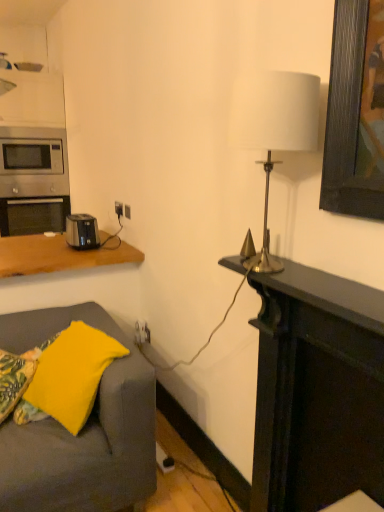
Describe the element at coordinates (317, 390) in the screenshot. I see `dark wood fireplace at right` at that location.

Describe the element at coordinates (72, 374) in the screenshot. I see `yellow fabric pillow at lower left, the 1th pillow when ordered from right to left` at that location.

Describe the element at coordinates (274, 129) in the screenshot. This screenshot has width=384, height=512. I see `white fabric lampshade at upper right` at that location.

In order to click on satin silver microwave at left in this screenshot , I will do `click(33, 162)`.

Locate an element on the screen. This screenshot has height=512, width=384. dark wood fireplace at right is located at coordinates (317, 390).

Does satin silver microwave at left lie behind white fabric lampshade at upper right?

That is True.

Is satin silver microwave at left inside or outside of white fabric lampshade at upper right?

satin silver microwave at left is located beyond the bounds of white fabric lampshade at upper right.

From the image's perspective, relative to white fabric lampshade at upper right, is satin silver microwave at left above or below?

satin silver microwave at left is situated higher than white fabric lampshade at upper right in the image.

How different are the orientations of satin silver microwave at left and white fabric lampshade at upper right in degrees?

90 degrees separate the facing orientations of satin silver microwave at left and white fabric lampshade at upper right.

From the image's perspective, who appears lower, dark wood fireplace at right or yellow fabric pillow at lower left, the 1th pillow when ordered from right to left?

dark wood fireplace at right, from the image's perspective.

Is dark wood fireplace at right behind yellow fabric pillow at lower left, the 1th pillow when ordered from right to left?

No, dark wood fireplace at right is in front of yellow fabric pillow at lower left, the 1th pillow when ordered from right to left.

From a real-world perspective, which object rests below the other?

dark wood fireplace at right is physically lower.

Is dark wood fireplace at right inside or outside of yellow fabric pillow at lower left, the second pillow in the left-to-right sequence?

The correct answer is: outside.

Is point (303, 456) behind point (12, 141)?

No, it is in front of (12, 141).

Which object is positioned more to the right, dark wood fireplace at right or satin silver microwave at left?

dark wood fireplace at right is more to the right.

Can we say dark wood fireplace at right lies outside satin silver microwave at left?

Yes, dark wood fireplace at right is not within satin silver microwave at left.

Considering the sizes of stainless steel oven at left and black plastic toaster at left in the image, is stainless steel oven at left taller or shorter than black plastic toaster at left?

In the image, stainless steel oven at left appears to be taller than black plastic toaster at left.

Is stainless steel oven at left located outside black plastic toaster at left?

That's correct, stainless steel oven at left is outside of black plastic toaster at left.

From a real-world perspective, is stainless steel oven at left over black plastic toaster at left?

Actually, stainless steel oven at left is physically below black plastic toaster at left in the real world.

Would you say stainless steel oven at left is a long distance from black plastic toaster at left?

Yes, stainless steel oven at left is far from black plastic toaster at left.

Based on their sizes in the image, would you say satin silver microwave at left is bigger or smaller than yellow fabric pillow at lower left, marked as the 1th pillow in a left-to-right arrangement?

In the image, satin silver microwave at left appears to be larger than yellow fabric pillow at lower left, marked as the 1th pillow in a left-to-right arrangement.

Is satin silver microwave at left oriented away from yellow fabric pillow at lower left, marked as the 1th pillow in a left-to-right arrangement?

No, satin silver microwave at left is not facing away from yellow fabric pillow at lower left, marked as the 1th pillow in a left-to-right arrangement.

From the image's perspective, does satin silver microwave at left appear lower than yellow fabric pillow at lower left, marked as the 1th pillow in a left-to-right arrangement?

No, from the image's perspective, satin silver microwave at left is not below yellow fabric pillow at lower left, marked as the 1th pillow in a left-to-right arrangement.

In the scene shown: Considering the sizes of objects satin silver microwave at left and yellow fabric pillow at lower left, marked as the 1th pillow in a left-to-right arrangement, in the image provided, who is shorter, satin silver microwave at left or yellow fabric pillow at lower left, marked as the 1th pillow in a left-to-right arrangement,?

yellow fabric pillow at lower left, marked as the 1th pillow in a left-to-right arrangement, is shorter.

Which of these two, white fabric lampshade at upper right or black plastic outlet at center, stands shorter?

Standing shorter between the two is black plastic outlet at center.

Which is in front, white fabric lampshade at upper right or black plastic outlet at center?

white fabric lampshade at upper right.

Are white fabric lampshade at upper right and black plastic outlet at center making contact?

white fabric lampshade at upper right is not next to black plastic outlet at center, and they're not touching.

Does white fabric lampshade at upper right turn towards black plastic outlet at center?

No, white fabric lampshade at upper right is not oriented towards black plastic outlet at center.

Is white fabric lampshade at upper right shorter than yellow fabric pillow at lower left, marked as the 1th pillow in a left-to-right arrangement?

No, white fabric lampshade at upper right is not shorter than yellow fabric pillow at lower left, marked as the 1th pillow in a left-to-right arrangement.

Would you say white fabric lampshade at upper right is a long distance from yellow fabric pillow at lower left, marked as the 1th pillow in a left-to-right arrangement?

Yes, white fabric lampshade at upper right and yellow fabric pillow at lower left, marked as the 1th pillow in a left-to-right arrangement, are quite far apart.

Between white fabric lampshade at upper right and yellow fabric pillow at lower left, marked as the 1th pillow in a left-to-right arrangement, which one has smaller size?

yellow fabric pillow at lower left, marked as the 1th pillow in a left-to-right arrangement, is smaller.

How different are the orientations of white fabric lampshade at upper right and yellow fabric pillow at lower left, marked as the 2th pillow in a right-to-left arrangement, in degrees?

white fabric lampshade at upper right and yellow fabric pillow at lower left, marked as the 2th pillow in a right-to-left arrangement, are facing 35 degrees away from each other.

Where is `lamp that appears above the satin silver microwave at left (from a real-world perspective)`? This screenshot has width=384, height=512. lamp that appears above the satin silver microwave at left (from a real-world perspective) is located at coordinates (274, 129).

The width and height of the screenshot is (384, 512). I want to click on desk below the yellow fabric pillow at lower left, the second pillow in the left-to-right sequence (from the image's perspective), so click(x=317, y=390).

Based on their spatial positions, is black plastic outlet at center or satin silver microwave at left further from yellow fabric pillow at lower left, marked as the 2th pillow in a right-to-left arrangement?

satin silver microwave at left.

Consider the image. Looking at the image, which one is located further to black plastic outlet at center, satin silver microwave at left or white fabric lampshade at upper right?

Among the two, white fabric lampshade at upper right is located further to black plastic outlet at center.

In the scene shown: When comparing their distances from black plastic toaster at left, does white fabric lampshade at upper right or yellow fabric pillow at lower left, the 1th pillow when ordered from right to left, seem closer?

yellow fabric pillow at lower left, the 1th pillow when ordered from right to left, is closer to black plastic toaster at left.

When comparing their distances from black plastic toaster at left, does satin silver microwave at left or yellow fabric pillow at lower left, marked as the 2th pillow in a right-to-left arrangement, seem closer?

yellow fabric pillow at lower left, marked as the 2th pillow in a right-to-left arrangement, is positioned closer to the anchor black plastic toaster at left.

From the image, which object appears to be nearer to yellow fabric pillow at lower left, the second pillow in the left-to-right sequence, stainless steel oven at left or satin silver microwave at left?

stainless steel oven at left is positioned closer to the anchor yellow fabric pillow at lower left, the second pillow in the left-to-right sequence.

Estimate the real-world distances between objects in this image. Which object is further from dark wood fireplace at right, yellow fabric pillow at lower left, marked as the 1th pillow in a left-to-right arrangement, or black plastic toaster at left?

black plastic toaster at left.

Considering their positions, is white fabric lampshade at upper right positioned closer to stainless steel oven at left than satin silver microwave at left?

satin silver microwave at left is positioned closer to the anchor stainless steel oven at left.

Which object lies nearer to the anchor point white fabric lampshade at upper right, black plastic toaster at left or yellow fabric pillow at lower left, the 1th pillow when ordered from right to left?

Among the two, yellow fabric pillow at lower left, the 1th pillow when ordered from right to left, is located nearer to white fabric lampshade at upper right.

Where is `lamp between dark wood fireplace at right and satin silver microwave at left along the z-axis`? This screenshot has height=512, width=384. lamp between dark wood fireplace at right and satin silver microwave at left along the z-axis is located at coordinates (274, 129).

In order to click on pillow between yellow fabric pillow at lower left, the 1th pillow when ordered from right to left, and stainless steel oven at left in the front-back direction in this screenshot , I will do `click(15, 378)`.

What are the coordinates of `toaster between dark wood fireplace at right and black plastic outlet at center along the z-axis` in the screenshot? It's located at (82, 231).

At what (x,y) coordinates should I click in order to perform the action: click on toaster located between yellow fabric pillow at lower left, marked as the 1th pillow in a left-to-right arrangement, and satin silver microwave at left in the depth direction. Please return your answer as a coordinate pair (x, y). Image resolution: width=384 pixels, height=512 pixels. Looking at the image, I should click on (82, 231).